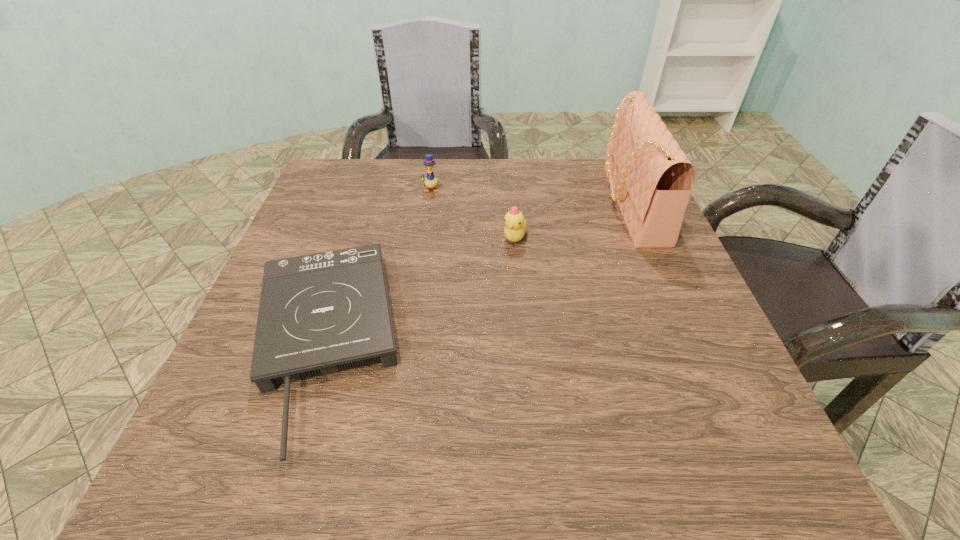
This screenshot has width=960, height=540. Find the location of `the rightmost object`. the rightmost object is located at coordinates (651, 179).

You are a GUI agent. You are given a task and a screenshot of the screen. Output one action in this format:
    pyautogui.click(x=<x>, y=<y>)
    Task: Click on the handbag
    
    Given the screenshot: What is the action you would take?
    click(x=651, y=179)

I want to click on the farther duckling, so click(430, 181).

Where is `the right duckling`? the right duckling is located at coordinates tap(515, 224).

Find the location of a particular element. The height and width of the screenshot is (540, 960). the nearer duckling is located at coordinates (515, 224).

The image size is (960, 540). What are the coordinates of `the shortest object` in the screenshot? It's located at (322, 313).

Locate an element on the screen. Image resolution: width=960 pixels, height=540 pixels. the nearest object is located at coordinates (322, 313).

Where is `vacant space located on the front-facing side of the tallest object`? vacant space located on the front-facing side of the tallest object is located at coordinates (568, 204).

This screenshot has height=540, width=960. In order to click on vacant space situated 0.310m on the front-facing side of the tallest object in this screenshot , I will do `click(479, 204)`.

Where is `vacant region located on the front-facing side of the tallest object`? The height and width of the screenshot is (540, 960). vacant region located on the front-facing side of the tallest object is located at coordinates (494, 204).